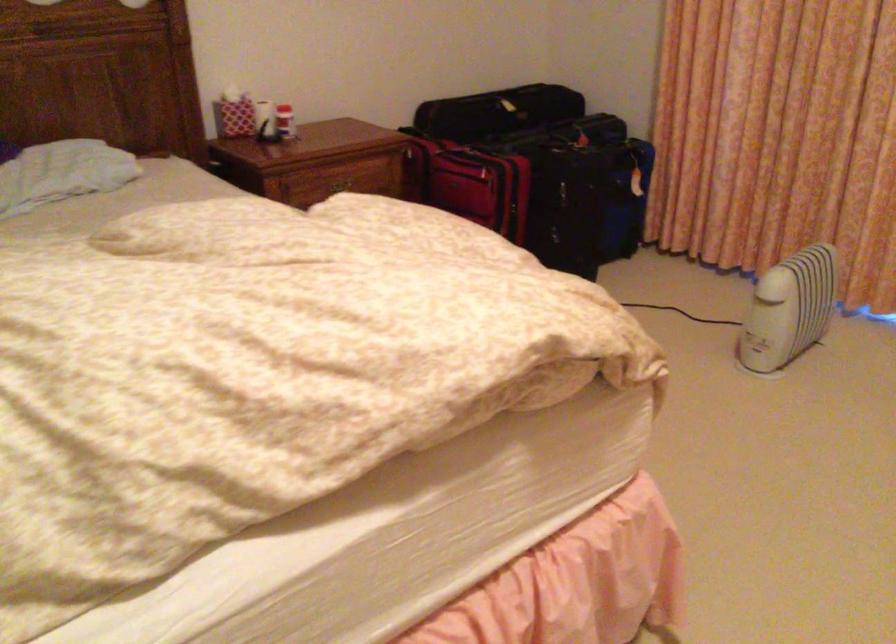
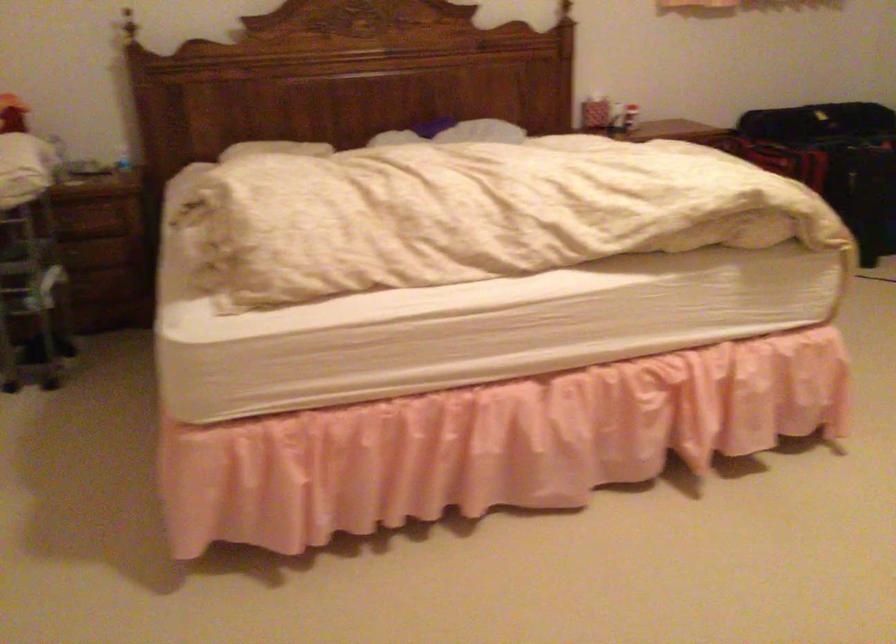
Question: I am providing you with two images of the same scene from different viewpoints. Which of the following objects are not visible in image2?

Choices:
 (A) wooden drawer handle
 (B) plastic water bottle
 (C) grey folded object
 (D) red and white box

Answer: (A)